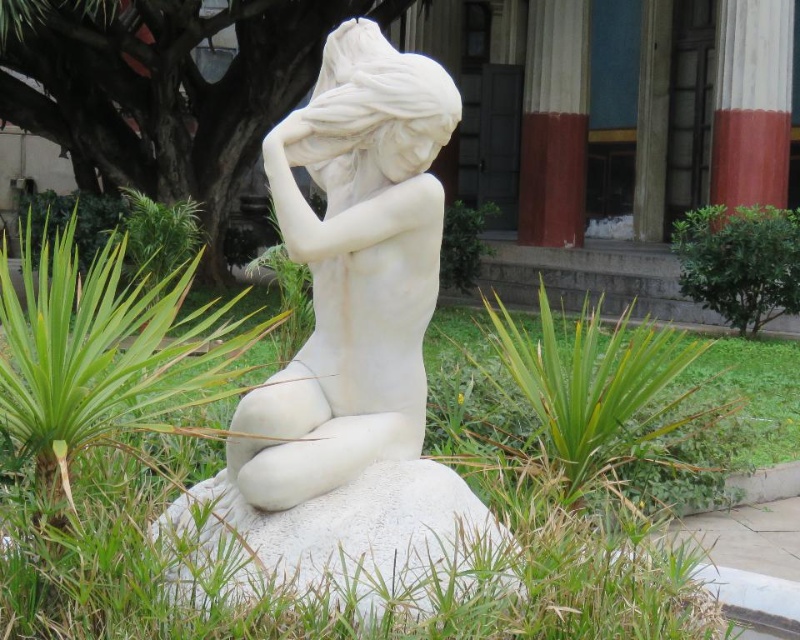
Question: Which object is positioned closest to the green leafy bush at right?

Choices:
 (A) white marble statue at center
 (B) green leafy plant at center

Answer: (B)

Question: Is the position of white marble statue at center more distant than that of green leafy plant at center?

Choices:
 (A) yes
 (B) no

Answer: (B)

Question: Is white marble statue at center smaller than green leafy bush at right?

Choices:
 (A) no
 (B) yes

Answer: (B)

Question: Which object is farther from the camera taking this photo?

Choices:
 (A) white marble statue at center
 (B) green leafy plant at center

Answer: (B)

Question: Can you confirm if green leafy bush at right is positioned above green leafy plant at center?

Choices:
 (A) no
 (B) yes

Answer: (A)

Question: Based on their relative distances, which object is nearer to the green leafy bush at right?

Choices:
 (A) green leafy plant at center
 (B) white marble statue at center

Answer: (A)